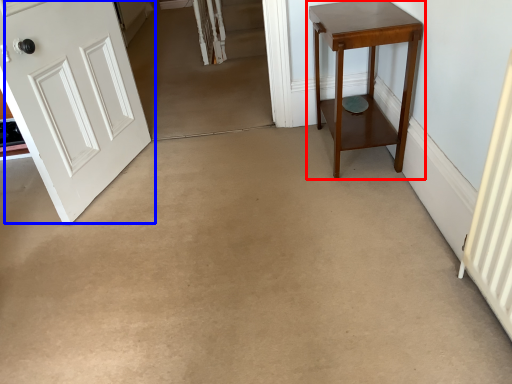
Question: Which object appears closest to the camera in this image, table (highlighted by a red box) or door (highlighted by a blue box)?

Choices:
 (A) table
 (B) door

Answer: (B)